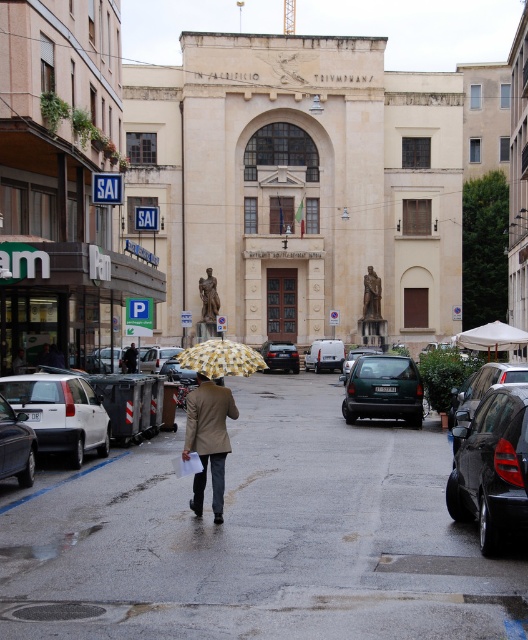
Is wet asphalt pavement at center to the left of metallic gray hatchback at center from the viewer's perspective?

Correct, you'll find wet asphalt pavement at center to the left of metallic gray hatchback at center.

Does point (185, 589) lie in front of point (351, 353)?

That is True.

Is point (154, 509) more distant than point (344, 362)?

No, (154, 509) is closer to viewer.

Identify the location of wet asphalt pavement at center. The width and height of the screenshot is (528, 640). (259, 536).

Is yellowmaterial/textureumbrella at center bigger than white matte van at center?

Indeed, yellowmaterial/textureumbrella at center has a larger size compared to white matte van at center.

Is yellowmaterial/textureumbrella at center taller than white matte van at center?

In fact, yellowmaterial/textureumbrella at center may be shorter than white matte van at center.

Is point (470, 328) positioned in front of point (323, 364)?

No, (470, 328) is behind (323, 364).

Where is `yellowmaterial/textureumbrella at center`? Image resolution: width=528 pixels, height=640 pixels. yellowmaterial/textureumbrella at center is located at coordinates (493, 337).

Between point (267, 472) and point (1, 460), which one is positioned behind?

The point (267, 472) is behind.

Identify the location of wet asphalt pavement at center. 259,536.